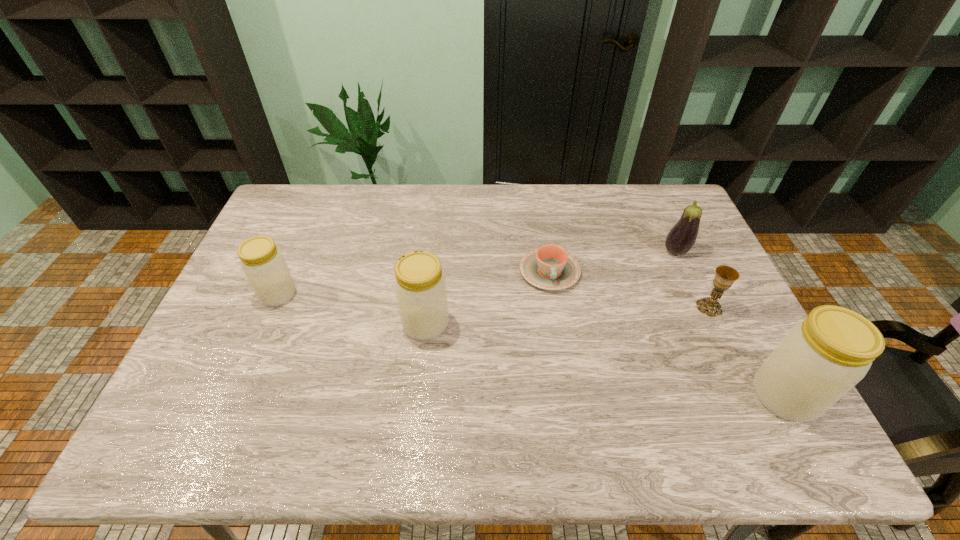
This screenshot has width=960, height=540. In order to click on vacant region located on the right of the leftmost jar in this screenshot , I will do `click(317, 294)`.

Identify the location of free space located on the right of the fifth object from right to left. (508, 324).

In order to click on vacant space situated 0.210m on the back of the nearest object in this screenshot , I will do `click(736, 306)`.

Locate an element on the screen. The width and height of the screenshot is (960, 540). vacant space located 0.130m on the left of the eggplant is located at coordinates (622, 251).

The image size is (960, 540). I want to click on vacant space located 0.300m on the handle side of the third object from left to right, so click(x=567, y=384).

Find the location of `free location located 0.400m on the left of the second shortest object`. free location located 0.400m on the left of the second shortest object is located at coordinates (557, 307).

Locate an element on the screen. object present at the near edge is located at coordinates (820, 359).

Where is `object that is at the left edge`? This screenshot has height=540, width=960. object that is at the left edge is located at coordinates (263, 264).

I want to click on jar positioned at the right edge, so click(x=820, y=359).

Locate an element on the screen. The image size is (960, 540). eggplant at the right edge is located at coordinates (681, 238).